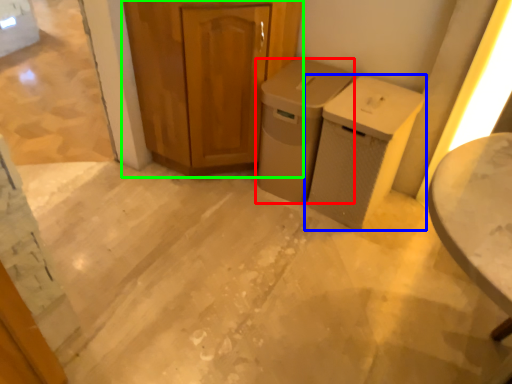
Question: Based on their relative distances, which object is farther from waste container (highlighted by a red box)? Choose from waste container (highlighted by a blue box) and cabinetry (highlighted by a green box).

Choices:
 (A) waste container
 (B) cabinetry

Answer: (B)